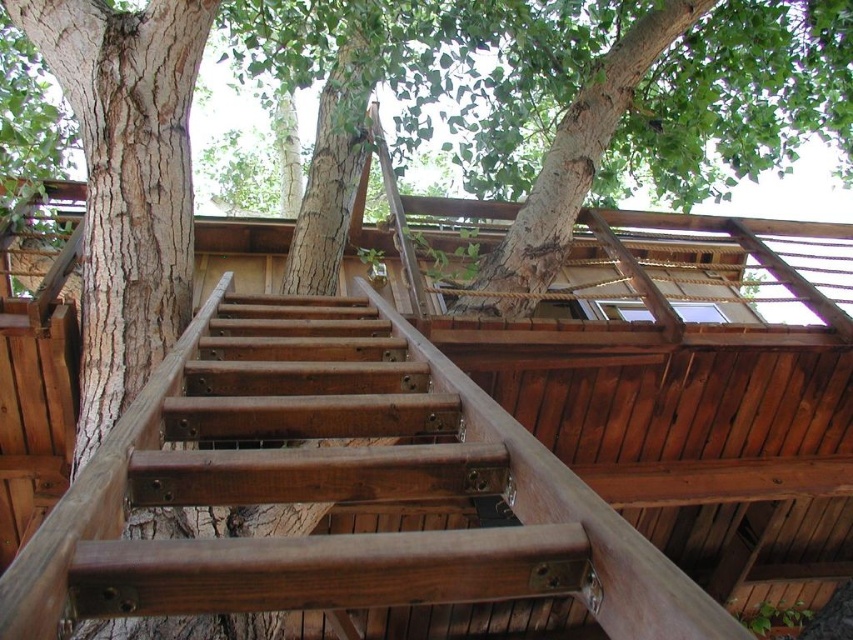
Question: From the image, what is the correct spatial relationship of brown wooden stairs at center in relation to wooden ladder at center?

Choices:
 (A) below
 (B) above

Answer: (A)

Question: Is brown wooden stairs at center bigger than wooden ladder at center?

Choices:
 (A) no
 (B) yes

Answer: (B)

Question: Which object appears closest to the camera in this image?

Choices:
 (A) brown wooden stairs at center
 (B) wooden ladder at center

Answer: (A)

Question: Among these objects, which one is farthest from the camera?

Choices:
 (A) brown wooden stairs at center
 (B) wooden ladder at center

Answer: (B)

Question: Can you confirm if brown wooden stairs at center is positioned to the right of wooden ladder at center?

Choices:
 (A) yes
 (B) no

Answer: (B)